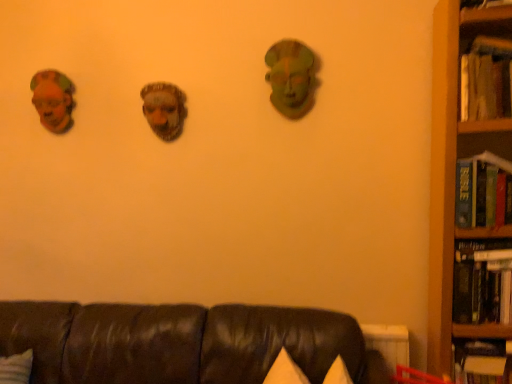
Measure the distance between point [490,381] and camera.

Point [490,381] and camera are 4.83 feet apart from each other.

Identify the location of hardcover book at right, arranged as the 1th book when viewed from the top. This screenshot has height=384, width=512. (486, 80).

The width and height of the screenshot is (512, 384). I want to click on hardcover book at right, marked as the third book in a top-to-bottom arrangement, so pos(477,282).

The height and width of the screenshot is (384, 512). Describe the element at coordinates (455, 171) in the screenshot. I see `wooden bookcase at right` at that location.

Where is `wooden bookcase at right`? This screenshot has width=512, height=384. wooden bookcase at right is located at coordinates (455, 171).

Identify the location of hardcover book at right, placed as the 2th book when sorted from top to bottom. (483, 191).

What do you see at coordinates (483, 191) in the screenshot? The image size is (512, 384). I see `hardcover book at right, the third book when ordered from bottom to top` at bounding box center [483, 191].

Where is `hardcover book at right, which is the first book in bottom-to-top order`? hardcover book at right, which is the first book in bottom-to-top order is located at coordinates (479, 361).

From a real-world perspective, is matte brown mask at left below wooden bookcase at right?

No, from a real-world perspective, matte brown mask at left is not beneath wooden bookcase at right.

The height and width of the screenshot is (384, 512). What are the coordinates of `bookcase below the matte brown mask at left (from the image's perspective)` in the screenshot? It's located at (455, 171).

Is matte brown mask at left to the left or to the right of wooden bookcase at right in the image?

Clearly, matte brown mask at left is on the left of wooden bookcase at right in the image.

Which is closer, (71, 103) or (446, 214)?

Positioned in front is point (446, 214).

Does hardcover book at right, marked as the third book in a top-to-bottom arrangement, touch hardcover book at right, placed as the 2th book when sorted from top to bottom?

They are not placed beside each other.

From a real-world perspective, does hardcover book at right, marked as the third book in a top-to-bottom arrangement, stand above hardcover book at right, the third book when ordered from bottom to top?

Actually, hardcover book at right, marked as the third book in a top-to-bottom arrangement, is physically below hardcover book at right, the third book when ordered from bottom to top, in the real world.

Does point (482, 290) come in front of point (490, 170)?

That is False.

I want to click on the 1st book below the hardcover book at right, the third book when ordered from bottom to top (from the image's perspective), so click(x=477, y=282).

Considering the relative positions of hardcover book at right, acting as the 4th book starting from the top, and hardcover book at right, the third book when ordered from bottom to top, in the image provided, is hardcover book at right, acting as the 4th book starting from the top, behind hardcover book at right, the third book when ordered from bottom to top,?

No, hardcover book at right, acting as the 4th book starting from the top, is closer to the camera.

Is hardcover book at right, acting as the 4th book starting from the top, looking in the opposite direction of hardcover book at right, placed as the 2th book when sorted from top to bottom?

No, hardcover book at right, acting as the 4th book starting from the top,'s orientation is not away from hardcover book at right, placed as the 2th book when sorted from top to bottom.

Is hardcover book at right, which is the first book in bottom-to-top order, taller than wooden bookcase at right?

In fact, hardcover book at right, which is the first book in bottom-to-top order, may be shorter than wooden bookcase at right.

Based on the photo, from a real-world perspective, which is physically below, hardcover book at right, acting as the 4th book starting from the top, or wooden bookcase at right?

In real-world perspective, hardcover book at right, acting as the 4th book starting from the top, is lower.

The image size is (512, 384). Identify the location of bookcase located above the hardcover book at right, acting as the 4th book starting from the top (from the image's perspective). (455, 171).

Starting from the hardcover book at right, which is the first book in bottom-to-top order, which book is the 3rd one to the left? Please provide its 2D coordinates.

[(486, 80)]

From the image's perspective, which one is positioned higher, hardcover book at right, arranged as the 1th book when viewed from the top, or hardcover book at right, which is the first book in bottom-to-top order?

hardcover book at right, arranged as the 1th book when viewed from the top.

Which of these two, hardcover book at right, arranged as the 1th book when viewed from the top, or hardcover book at right, acting as the 4th book starting from the top, is thinner?

Thinner between the two is hardcover book at right, arranged as the 1th book when viewed from the top.

Which is behind, point (490, 39) or point (457, 357)?

The point (457, 357) is more distant.

From a real-world perspective, relative to leather couch at lower center, is hardcover book at right, placed as the 2th book when sorted from top to bottom, vertically above or below?

Clearly, from a real-world perspective, hardcover book at right, placed as the 2th book when sorted from top to bottom, is above leather couch at lower center.

Which object is thinner, hardcover book at right, the third book when ordered from bottom to top, or leather couch at lower center?

Thinner between the two is hardcover book at right, the third book when ordered from bottom to top.

Does hardcover book at right, placed as the 2th book when sorted from top to bottom, turn towards leather couch at lower center?

No, hardcover book at right, placed as the 2th book when sorted from top to bottom, is not oriented towards leather couch at lower center.

Can you confirm if hardcover book at right, marked as the third book in a top-to-bottom arrangement, is smaller than matte brown mask at left?

Actually, hardcover book at right, marked as the third book in a top-to-bottom arrangement, might be larger than matte brown mask at left.

Is hardcover book at right, positioned as the 2th book in bottom-to-top order, spatially inside matte brown mask at left, or outside of it?

hardcover book at right, positioned as the 2th book in bottom-to-top order, lies outside matte brown mask at left.

How far apart are hardcover book at right, marked as the third book in a top-to-bottom arrangement, and matte brown mask at left?

A distance of 1.88 meters exists between hardcover book at right, marked as the third book in a top-to-bottom arrangement, and matte brown mask at left.

Can you tell me how much hardcover book at right, positioned as the 2th book in bottom-to-top order, and matte brown mask at left differ in facing direction?

2.35 degrees.

This screenshot has width=512, height=384. In order to click on bookcase that is under the matte brown mask at left (from a real-world perspective) in this screenshot , I will do `click(455, 171)`.

Starting from the hardcover book at right, positioned as the 2th book in bottom-to-top order, which book is the 2nd one behind? Please provide its 2D coordinates.

[(483, 191)]

Based on their spatial positions, is hardcover book at right, acting as the 4th book starting from the top, or wooden bookcase at right further from hardcover book at right, arranged as the 1th book when viewed from the top?

Among the two, hardcover book at right, acting as the 4th book starting from the top, is located further to hardcover book at right, arranged as the 1th book when viewed from the top.

Considering their positions, is leather couch at lower center positioned closer to hardcover book at right, arranged as the 1th book when viewed from the top, than hardcover book at right, which is the first book in bottom-to-top order?

hardcover book at right, which is the first book in bottom-to-top order, is positioned closer to the anchor hardcover book at right, arranged as the 1th book when viewed from the top.

When comparing their distances from matte brown mask at left, does hardcover book at right, acting as the 4th book starting from the top, or hardcover book at right, positioned as the 2th book in bottom-to-top order, seem closer?

hardcover book at right, positioned as the 2th book in bottom-to-top order, is positioned closer to the anchor matte brown mask at left.

When comparing their distances from leather couch at lower center, does hardcover book at right, placed as the 2th book when sorted from top to bottom, or hardcover book at right, acting as the 4th book starting from the top, seem closer?

The object closer to leather couch at lower center is hardcover book at right, acting as the 4th book starting from the top.

When comparing their distances from leather couch at lower center, does hardcover book at right, marked as the third book in a top-to-bottom arrangement, or hardcover book at right, arranged as the 1th book when viewed from the top, seem further?

hardcover book at right, arranged as the 1th book when viewed from the top, is further to leather couch at lower center.

When comparing their distances from hardcover book at right, which is the fourth book from bottom to top, does hardcover book at right, placed as the 2th book when sorted from top to bottom, or leather couch at lower center seem further?

leather couch at lower center lies further to hardcover book at right, which is the fourth book from bottom to top, than the other object.

From the image, which object appears to be farther from matte brown mask at left, hardcover book at right, arranged as the 1th book when viewed from the top, or hardcover book at right, placed as the 2th book when sorted from top to bottom?

hardcover book at right, placed as the 2th book when sorted from top to bottom, lies further to matte brown mask at left than the other object.

Based on their spatial positions, is matte brown mask at left or hardcover book at right, acting as the 4th book starting from the top, further from wooden bookcase at right?

Answer: The object further to wooden bookcase at right is matte brown mask at left.

The image size is (512, 384). I want to click on bookcase located between leather couch at lower center and hardcover book at right, which is the first book in bottom-to-top order, in the left-right direction, so 455,171.

What are the coordinates of `bookcase between hardcover book at right, placed as the 2th book when sorted from top to bottom, and hardcover book at right, positioned as the 2th book in bottom-to-top order, in the up-down direction` in the screenshot? It's located at (455, 171).

The width and height of the screenshot is (512, 384). What are the coordinates of `book between hardcover book at right, placed as the 2th book when sorted from top to bottom, and hardcover book at right, which is the first book in bottom-to-top order, in the up-down direction` in the screenshot? It's located at coord(477,282).

The width and height of the screenshot is (512, 384). What are the coordinates of `book situated between leather couch at lower center and hardcover book at right, placed as the 2th book when sorted from top to bottom, from left to right` in the screenshot? It's located at (486, 80).